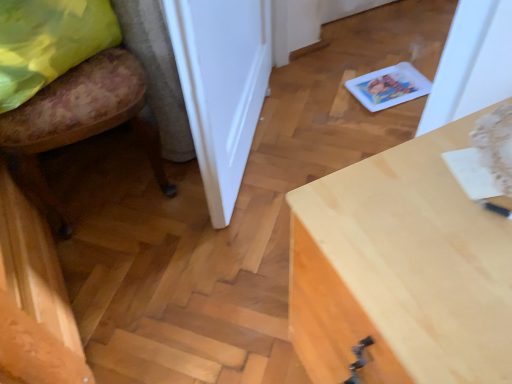
Identify the location of vacant region in front of white glossy door at center. (210, 254).